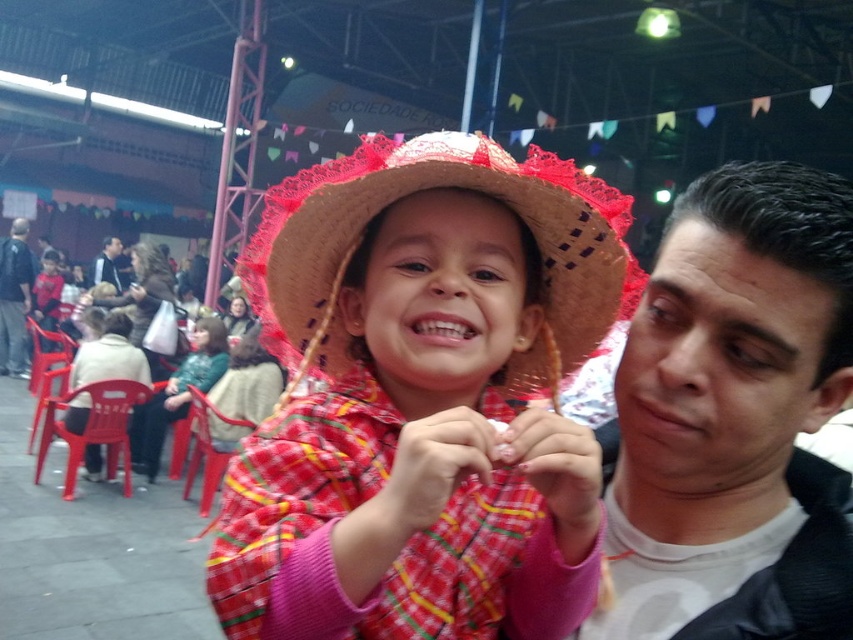
Between straw hat at center and dark blue jeans at left, which one appears on the right side from the viewer's perspective?

Positioned to the right is straw hat at center.

The image size is (853, 640). I want to click on straw hat at center, so click(x=432, y=188).

Which of these two, straw hat at center or dark gray fabric jacket at upper center, stands shorter?

With less height is straw hat at center.

From the picture: Can you confirm if straw hat at center is positioned above dark gray fabric jacket at upper center?

Actually, straw hat at center is below dark gray fabric jacket at upper center.

Is point (376, 150) behind point (112, 248)?

No, it is not.

Identify the location of straw hat at center. The image size is (853, 640). (432, 188).

Does smooth black jacket at right have a larger size compared to dark gray fabric jacket at upper center?

Actually, smooth black jacket at right might be smaller than dark gray fabric jacket at upper center.

Based on the photo, can you confirm if smooth black jacket at right is smaller than dark gray fabric jacket at upper center?

Yes.

This screenshot has height=640, width=853. I want to click on smooth black jacket at right, so click(x=734, y=419).